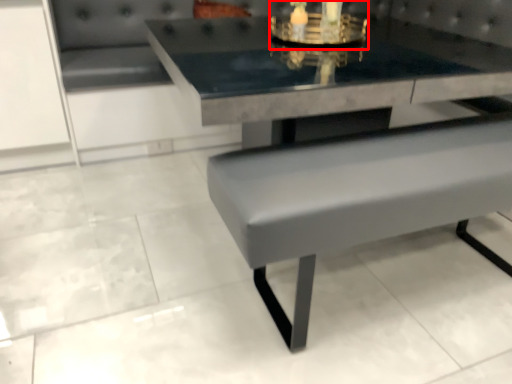
Question: From the image's perspective, considering the relative positions of candle holder (annotated by the red box) and picnic table in the image provided, where is candle holder (annotated by the red box) located with respect to the staircase?

Choices:
 (A) above
 (B) below

Answer: (A)